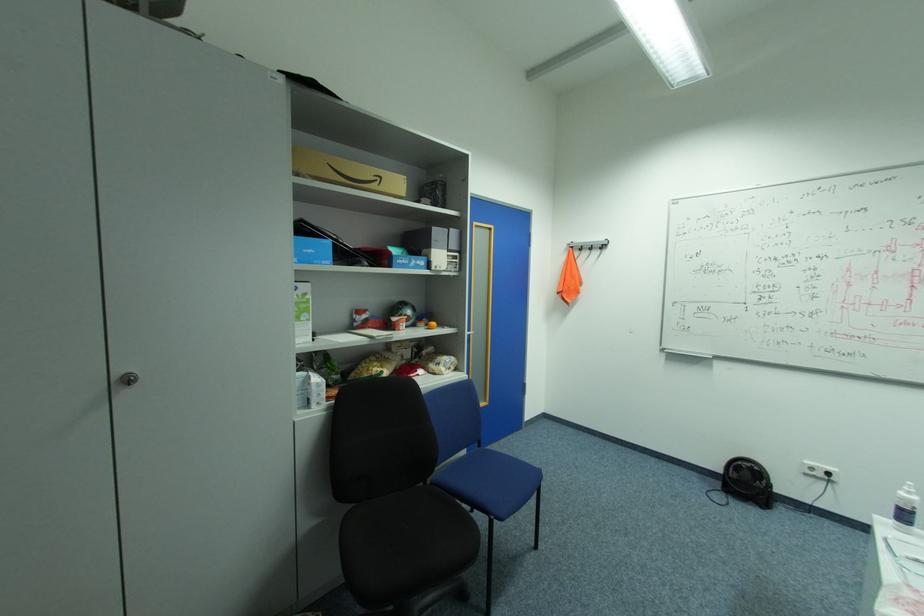
Locate an element on the screen. The image size is (924, 616). red and white cup is located at coordinates (398, 322).